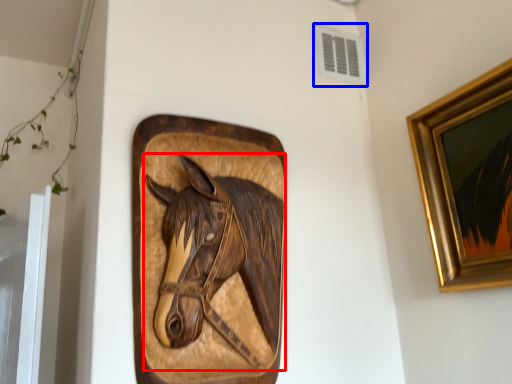
Question: Which object is further to the camera taking this photo, horse (highlighted by a red box) or air conditioning (highlighted by a blue box)?

Choices:
 (A) horse
 (B) air conditioning

Answer: (B)